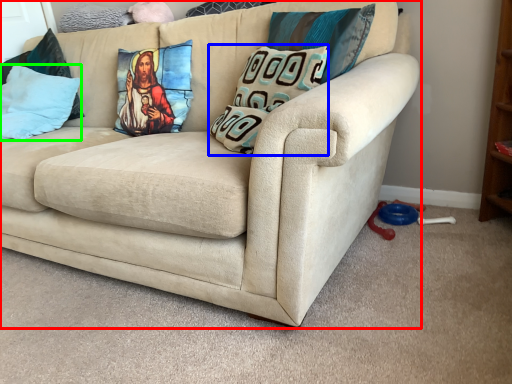
Question: Which is nearer to the studio couch (highlighted by a red box)? pillow (highlighted by a blue box) or pillow (highlighted by a green box).

Choices:
 (A) pillow
 (B) pillow

Answer: (A)